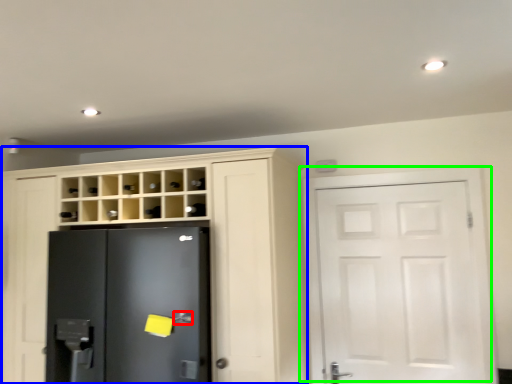
Question: Which is farther away from door handle (highlighted by a red box)? cupboard (highlighted by a blue box) or door (highlighted by a green box)?

Choices:
 (A) cupboard
 (B) door

Answer: (B)